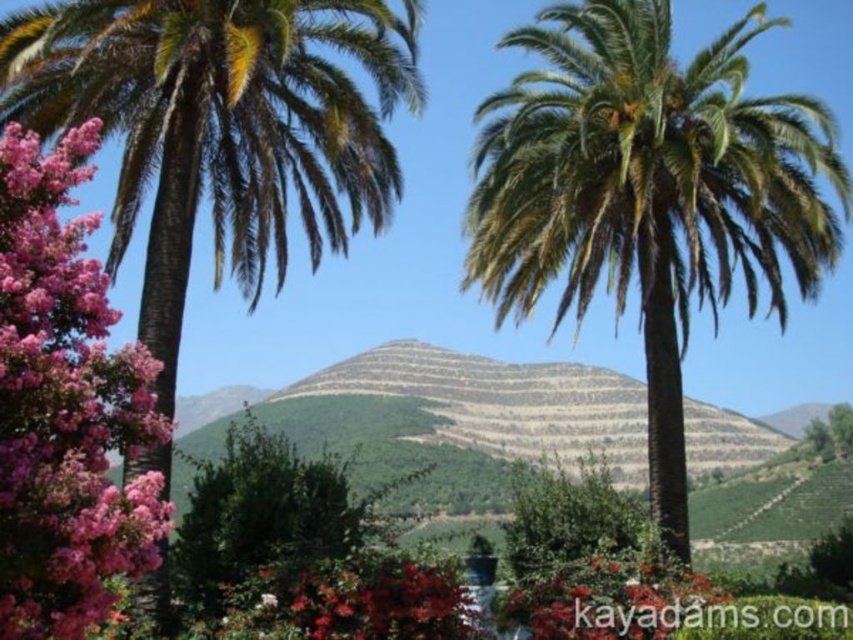
Which is more to the right, green leafy palm tree at left or pink fluffy flowers at left?

Positioned to the right is green leafy palm tree at left.

Between green leafy palm tree at left and pink fluffy flowers at left, which one has more height?

green leafy palm tree at left is taller.

Who is more forward, (x=286, y=150) or (x=22, y=326)?

Point (x=22, y=326)

What are the coordinates of `green leafy palm tree at left` in the screenshot? It's located at (221, 125).

Can you confirm if green leafy palm at center is positioned to the right of green leafy palm tree at left?

Yes, green leafy palm at center is to the right of green leafy palm tree at left.

Based on the photo, does green leafy palm at center have a greater height compared to green leafy palm tree at left?

Correct, green leafy palm at center is much taller as green leafy palm tree at left.

Locate an element on the screen. Image resolution: width=853 pixels, height=640 pixels. green leafy palm at center is located at coordinates (648, 193).

Is green leafy palm at center further to camera compared to green leafy bush at center?

No, it is not.

Is green leafy palm at center to the left of green leafy bush at center from the viewer's perspective?

Incorrect, green leafy palm at center is not on the left side of green leafy bush at center.

Is point (633, 40) closer to viewer compared to point (509, 541)?

Yes.

Find the location of a particular element. This screenshot has height=640, width=853. green leafy palm at center is located at coordinates (648, 193).